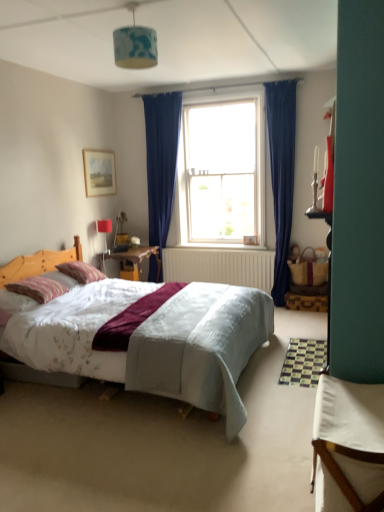
Question: Considering the positions of white glass window at center and striped cotton pillow at left, marked as the second pillow in a back-to-front arrangement, in the image, is white glass window at center bigger or smaller than striped cotton pillow at left, marked as the second pillow in a back-to-front arrangement,?

Choices:
 (A) small
 (B) big

Answer: (B)

Question: Relative to striped cotton pillow at left, the first pillow when ordered from front to back, is white glass window at center in front or behind?

Choices:
 (A) front
 (B) behind

Answer: (B)

Question: Estimate the real-world distances between objects in this image. Which object is farther from the wooden picture frame at upper left?

Choices:
 (A) white fabric table at lower right
 (B) striped fabric pillow at left, which is the first pillow in back-to-front order
 (C) striped cotton pillow at left, the first pillow when ordered from front to back
 (D) blue fabric lampshade at upper center
 (E) white glass window at center

Answer: (A)

Question: Which object is positioned farthest from the striped cotton pillow at left, the first pillow when ordered from front to back?

Choices:
 (A) striped fabric pillow at left, which is the first pillow in back-to-front order
 (B) white glass window at center
 (C) blue fabric lampshade at upper center
 (D) white fabric table at lower right
 (E) wooden picture frame at upper left

Answer: (B)